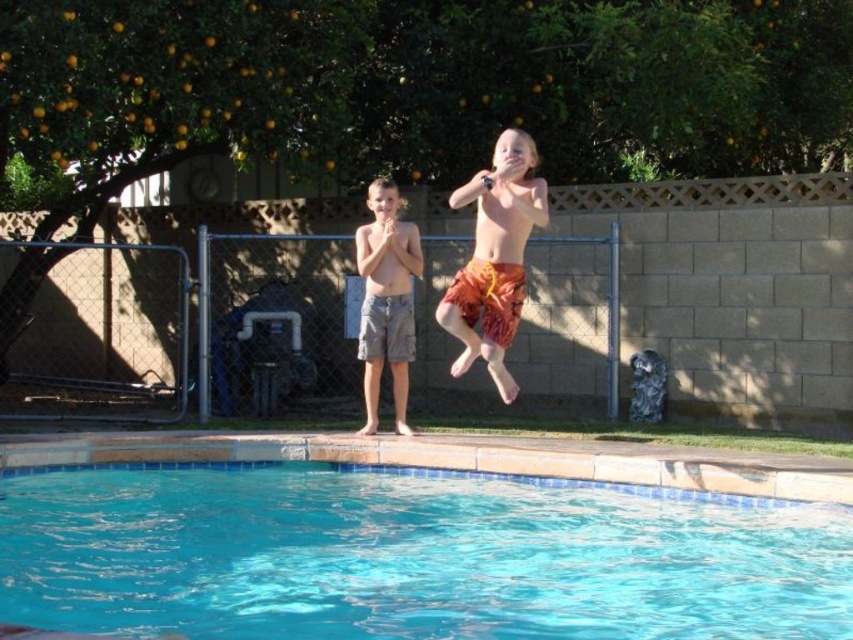
Question: Based on their relative distances, which object is nearer to the orange printed shorts at center?

Choices:
 (A) camo shorts at center
 (B) blue tile water at center

Answer: (A)

Question: Is blue tile water at center positioned behind orange printed shorts at center?

Choices:
 (A) no
 (B) yes

Answer: (A)

Question: Based on their relative distances, which object is farther from the orange printed shorts at center?

Choices:
 (A) blue tile water at center
 (B) camo shorts at center

Answer: (A)

Question: Which is nearer to the camo shorts at center?

Choices:
 (A) blue tile water at center
 (B) orange printed shorts at center

Answer: (B)

Question: Is blue tile water at center bigger than camo shorts at center?

Choices:
 (A) yes
 (B) no

Answer: (A)

Question: Is blue tile water at center to the right of camo shorts at center from the viewer's perspective?

Choices:
 (A) no
 (B) yes

Answer: (B)